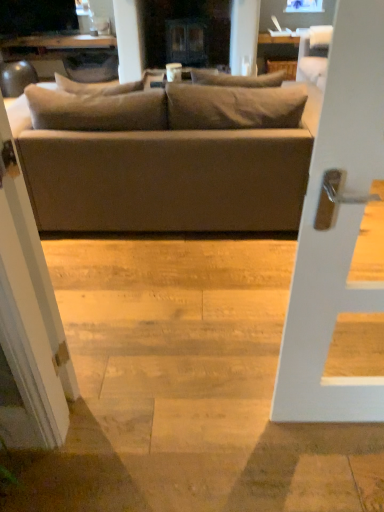
This screenshot has height=512, width=384. I want to click on vacant space that is to the left of white matte door handle at center, so click(245, 446).